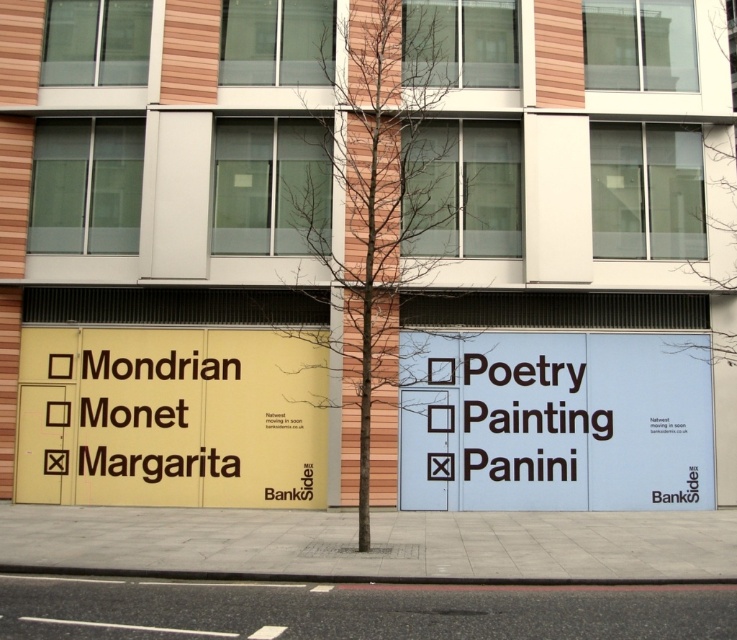
You are a visitor approaching the building and want to read both the white paper sign at center and the yellow matte signboard at left. Which sign should you look at first to follow the proper reading order from left to right?

The yellow matte signboard at left should be read first since it is positioned to the left of the white paper sign at center, following the left to right reading order.

You are a visitor approaching the building and see the white paper sign at center and the yellow matte signboard at left. Which sign is closer to you as you face the building?

The white paper sign at center is closer to you because it is in front of the yellow matte signboard at left.